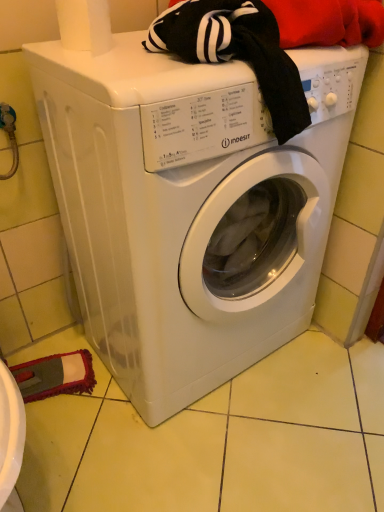
Question: Considering the relative sizes of white plastic washing machine at center and white paper towel at upper left in the image provided, is white plastic washing machine at center smaller than white paper towel at upper left?

Choices:
 (A) yes
 (B) no

Answer: (B)

Question: Is white paper towel at upper left a part of white plastic washing machine at center?

Choices:
 (A) yes
 (B) no

Answer: (B)

Question: Is white plastic washing machine at center further to the viewer compared to white paper towel at upper left?

Choices:
 (A) no
 (B) yes

Answer: (A)

Question: Can we say white plastic washing machine at center lies outside white paper towel at upper left?

Choices:
 (A) yes
 (B) no

Answer: (A)

Question: From a real-world perspective, is white plastic washing machine at center beneath white paper towel at upper left?

Choices:
 (A) no
 (B) yes

Answer: (B)

Question: Can you confirm if white plastic washing machine at center is positioned to the right of white paper towel at upper left?

Choices:
 (A) no
 (B) yes

Answer: (B)

Question: Is white paper towel at upper left aimed at white plastic washing machine at center?

Choices:
 (A) no
 (B) yes

Answer: (A)

Question: From the image's perspective, is white paper towel at upper left on white plastic washing machine at center?

Choices:
 (A) no
 (B) yes

Answer: (B)

Question: Can you confirm if white paper towel at upper left is smaller than white plastic washing machine at center?

Choices:
 (A) no
 (B) yes

Answer: (B)

Question: Does white paper towel at upper left contain white plastic washing machine at center?

Choices:
 (A) no
 (B) yes

Answer: (A)

Question: Is white paper towel at upper left oriented away from white plastic washing machine at center?

Choices:
 (A) no
 (B) yes

Answer: (A)

Question: Is white paper towel at upper left at the right side of white plastic washing machine at center?

Choices:
 (A) yes
 (B) no

Answer: (B)

Question: From a real-world perspective, is white plastic washing machine at center above or below white paper towel at upper left?

Choices:
 (A) above
 (B) below

Answer: (B)